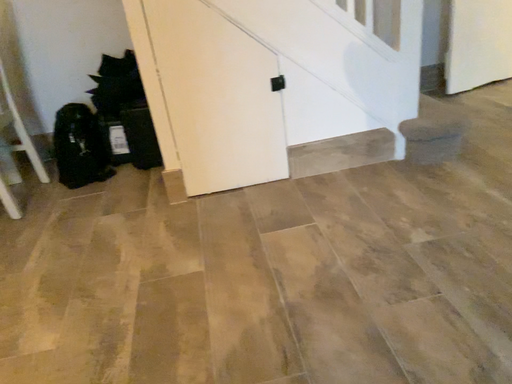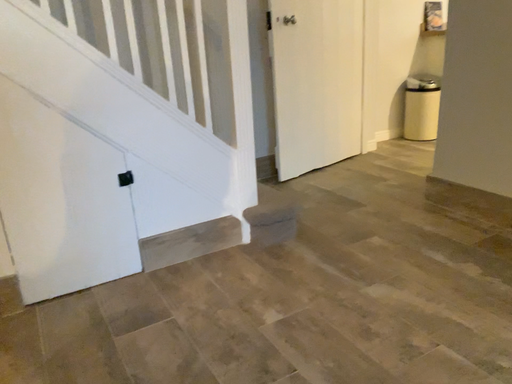
Question: How did the camera likely rotate when shooting the video?

Choices:
 (A) rotated left
 (B) rotated right

Answer: (B)